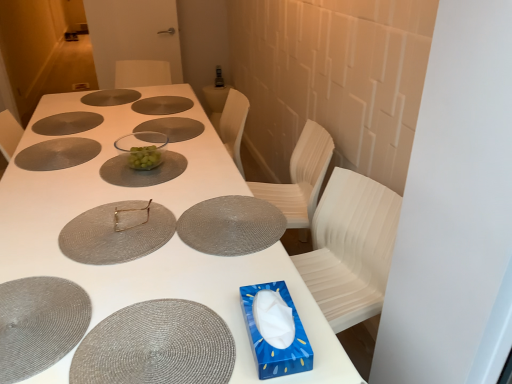
Identify the location of vacant space to the right of blue paper tissue box at lower right. This screenshot has width=512, height=384. (317, 335).